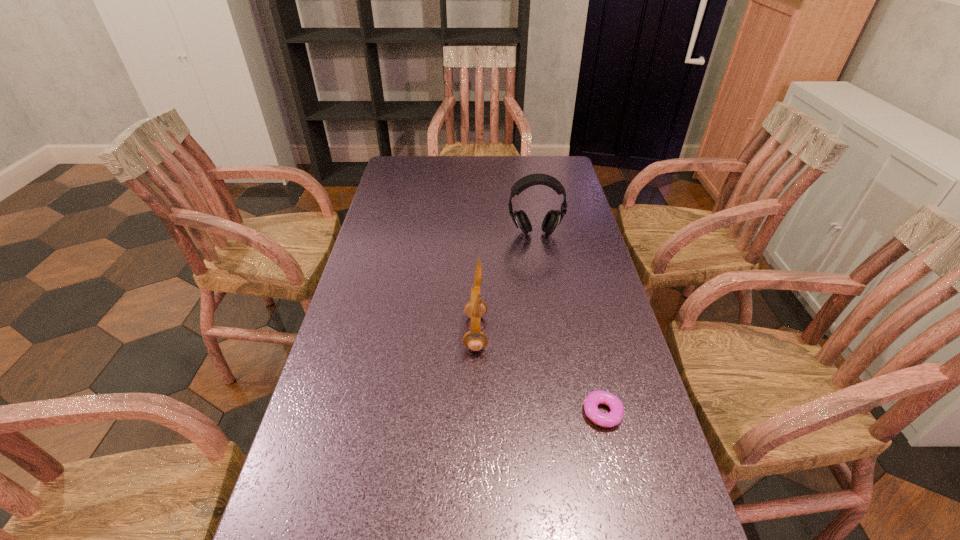
Identify the location of the farther earphone. This screenshot has width=960, height=540. (553, 218).

The width and height of the screenshot is (960, 540). Identify the location of the right earphone. (553, 218).

Find the location of a particular element. the leftmost object is located at coordinates (475, 340).

The height and width of the screenshot is (540, 960). I want to click on the nearer earphone, so click(x=475, y=340).

The width and height of the screenshot is (960, 540). In order to click on the nearest object in this screenshot , I will do `click(593, 399)`.

The height and width of the screenshot is (540, 960). What are the coordinates of `doughnut` in the screenshot? It's located at (593, 399).

Find the location of a particular element. The height and width of the screenshot is (540, 960). vacant point located 0.130m on the ear cups of the farthest object is located at coordinates (540, 266).

Identify the location of free location located 0.120m on the front-facing side of the second farthest object. (535, 333).

Identify the location of vacant region located 0.240m on the left of the shortest object. (471, 413).

Find the location of a particular element. Image resolution: width=960 pixels, height=540 pixels. earphone that is at the right edge is located at coordinates (553, 218).